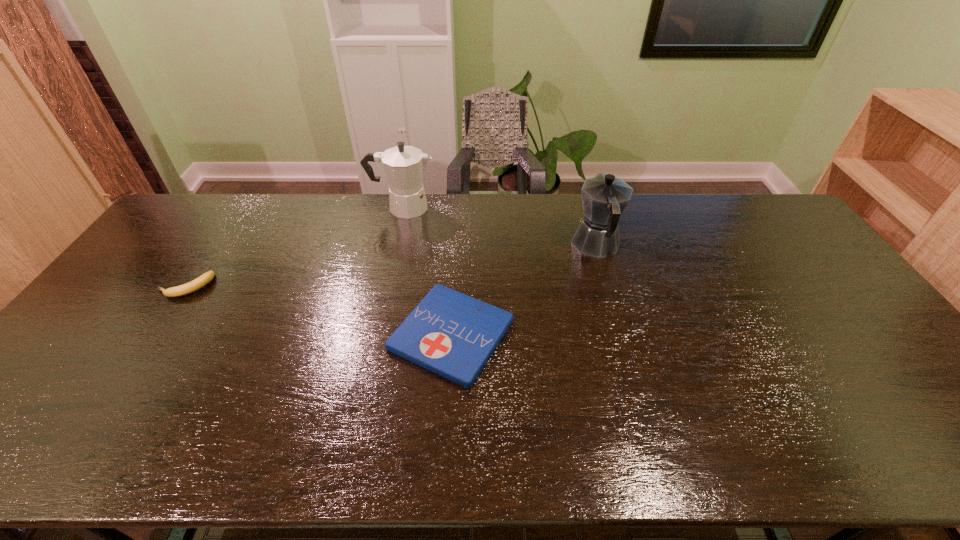
Image resolution: width=960 pixels, height=540 pixels. I want to click on the farthest object, so click(x=404, y=165).

You are a GUI agent. You are given a task and a screenshot of the screen. Output one action in this format:
    pyautogui.click(x=<x>, y=<y>)
    Task: Click on the left coffeepot
    This screenshot has height=540, width=960.
    Given the screenshot: What is the action you would take?
    pyautogui.click(x=404, y=165)

Image resolution: width=960 pixels, height=540 pixels. Identify the location of the nearer coffeepot. (604, 197).

Identify the location of the second farthest object. (604, 197).

I want to click on banana, so click(x=206, y=278).

You are a GUI agent. You are given a task and a screenshot of the screen. Output one action in this format:
    pyautogui.click(x=<x>, y=<y>)
    Task: Click on the shortest object
    Image resolution: width=960 pixels, height=540 pixels.
    Given the screenshot: What is the action you would take?
    pyautogui.click(x=451, y=334)

You are a GUI agent. You are given a task and a screenshot of the screen. Output one action in this format:
    pyautogui.click(x=<x>, y=<y>)
    Task: Click on the free location located at the spout of the farthest object
    The height and width of the screenshot is (540, 960).
    Given the screenshot: What is the action you would take?
    pyautogui.click(x=513, y=207)

Identify the location of vacant region located 0.170m at the spout of the right coffeepot. pyautogui.click(x=582, y=196).

This screenshot has height=540, width=960. I want to click on vacant space located 0.170m at the spout of the right coffeepot, so click(582, 196).

Locate an element on the screen. This screenshot has height=540, width=960. vacant space positioned at the spout of the right coffeepot is located at coordinates (584, 202).